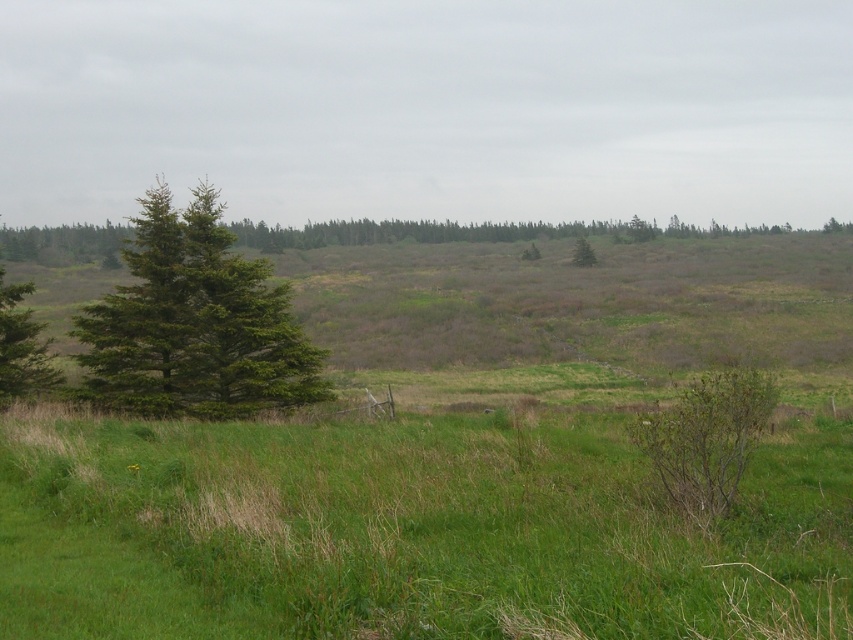
This screenshot has width=853, height=640. I want to click on green matte tree at left, so click(x=195, y=323).

Which is more to the right, green matte tree at left or green matte tree at center?

Positioned to the right is green matte tree at center.

I want to click on green matte tree at left, so click(x=195, y=323).

Who is more forward, (47, 356) or (585, 243)?

Point (47, 356) is in front.

Locate an element on the screen. green needle-like at left is located at coordinates (22, 346).

Find the location of a particular element. This screenshot has height=640, width=853. green needle-like at left is located at coordinates (22, 346).

Is green matte tree at left taller than green needle-like at left?

Yes, green matte tree at left is taller than green needle-like at left.

Between point (78, 320) and point (61, 376), which one is positioned in front?

Positioned in front is point (78, 320).

Between point (119, 381) and point (9, 365), which one is positioned in front?

Point (9, 365) is in front.

This screenshot has height=640, width=853. I want to click on green matte tree at left, so click(x=195, y=323).